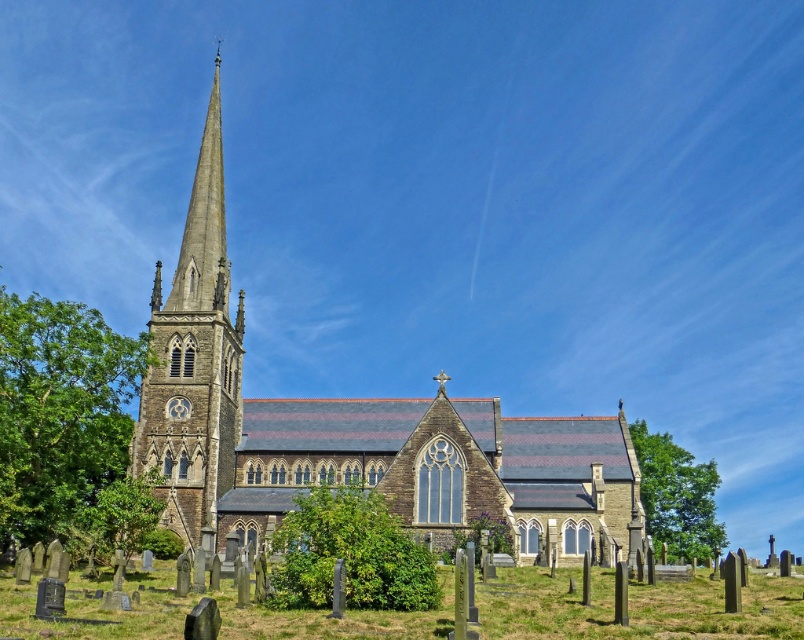
Can you confirm if green grass at lower center is taller than green leafy tree at left?

Incorrect, green grass at lower center's height is not larger of green leafy tree at left's.

Can you confirm if green grass at lower center is bigger than green leafy tree at left?

Actually, green grass at lower center might be smaller than green leafy tree at left.

Is point (129, 627) farther from camera compared to point (92, 388)?

No.

At what (x,y) coordinates should I click in order to perform the action: click on green grass at lower center. Please return your answer as a coordinate pair (x, y). This screenshot has width=804, height=640. Looking at the image, I should click on (634, 605).

Is green leafy tree at left smaller than green leafy bush at center?

No, green leafy tree at left is not smaller than green leafy bush at center.

I want to click on green leafy tree at left, so click(x=68, y=422).

Identify the location of green leafy tree at left. (68, 422).

Which is above, stone church at center or green leafy tree at lower right?

stone church at center

Is stone church at center behind green leafy tree at lower right?

That is False.

From the picture: Who is more distant from viewer, (565, 460) or (653, 493)?

Positioned behind is point (653, 493).

The image size is (804, 640). In order to click on stone church at center in this screenshot , I will do `click(355, 429)`.